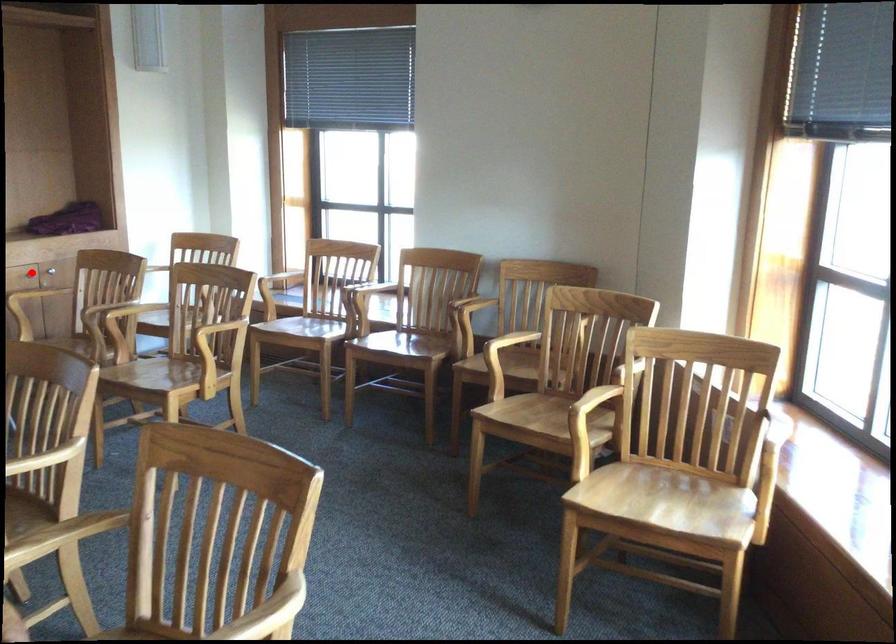
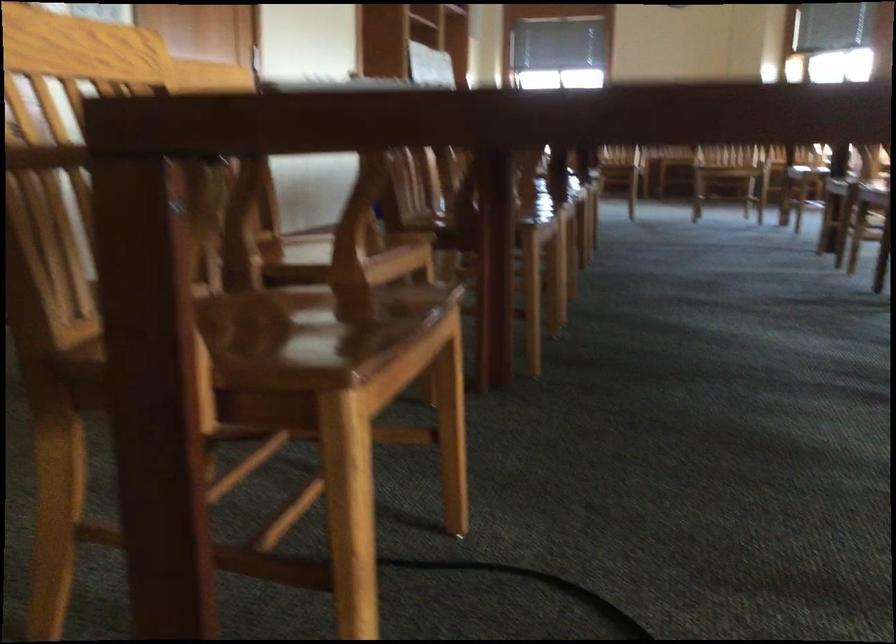
Question: I am providing you with two images of the same scene from different viewpoints. A red point is marked on the first image. Is the red point's position out of view in image 2?

Choices:
 (A) Yes
 (B) No

Answer: (A)